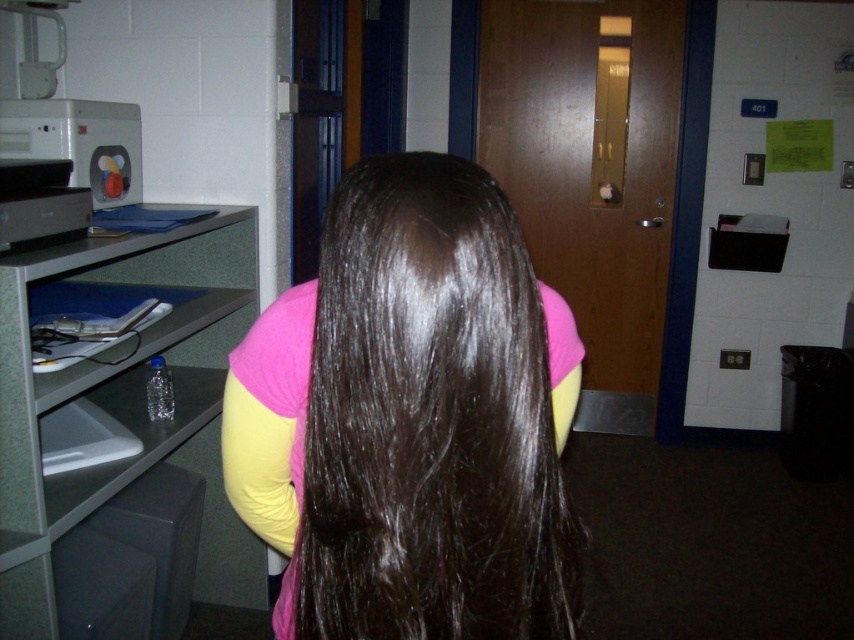
Who is shorter, shiny brown hair at center or gray plastic file cabinet at left?

Standing shorter between the two is shiny brown hair at center.

Does point (370, 257) come closer to viewer compared to point (51, 476)?

Yes.

This screenshot has width=854, height=640. Identify the location of shiny brown hair at center. coord(411,419).